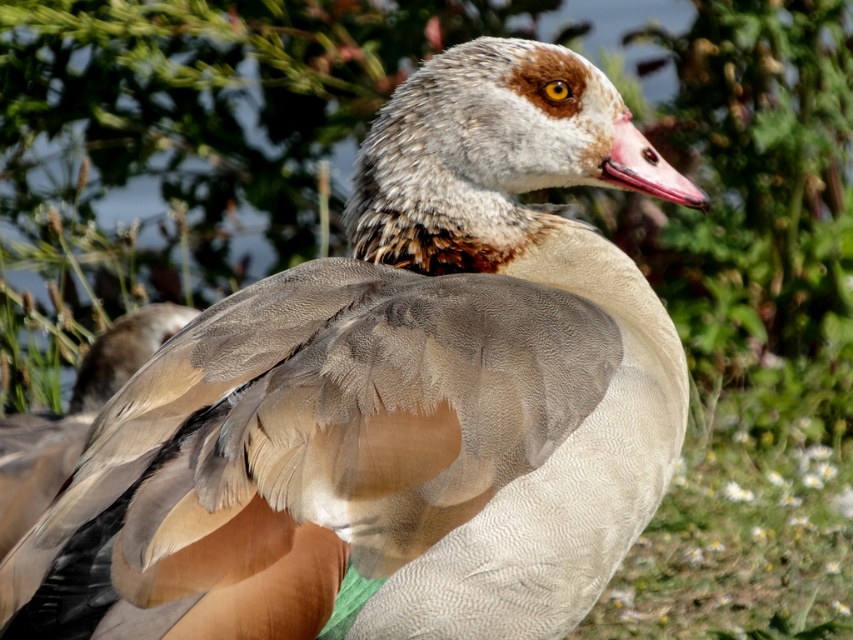
Is brown feathered wing at center smaller than pink matte beak at center?

Incorrect, brown feathered wing at center is not smaller in size than pink matte beak at center.

Measure the distance from brown feathered wing at center to pink matte beak at center.

brown feathered wing at center is 3.90 feet away from pink matte beak at center.

Does point (33, 448) come closer to viewer compared to point (674, 177)?

That is False.

Locate an element on the screen. brown feathered wing at center is located at coordinates (73, 417).